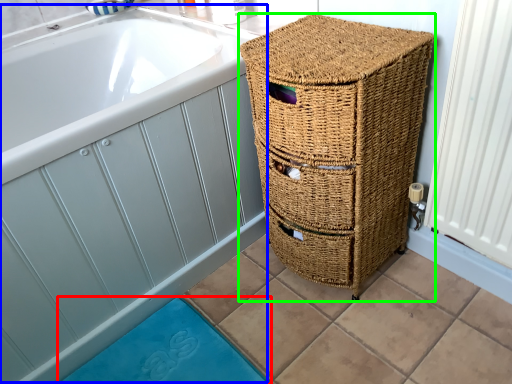
Question: Which object is the closest to the bath mat (highlighted by a red box)? Choose among these: bath (highlighted by a blue box) or furniture (highlighted by a green box).

Choices:
 (A) bath
 (B) furniture

Answer: (A)